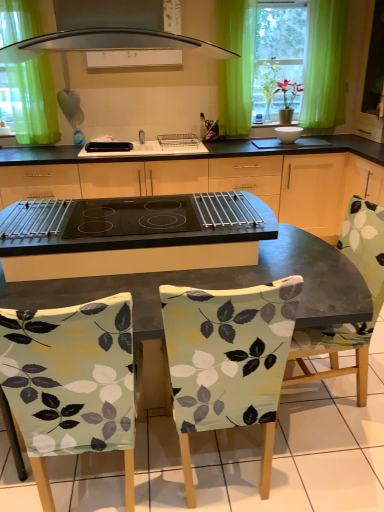
Question: Can you confirm if green fabric curtain at upper left, the 2th curtain in the right-to-left sequence, is thinner than black glass cooktop at center?

Choices:
 (A) yes
 (B) no

Answer: (A)

Question: From the image's perspective, is green fabric curtain at upper left, which is counted as the 1th curtain, starting from the left, above black glass cooktop at center?

Choices:
 (A) yes
 (B) no

Answer: (A)

Question: From a real-world perspective, does green fabric curtain at upper left, which is counted as the 1th curtain, starting from the left, sit lower than black glass cooktop at center?

Choices:
 (A) yes
 (B) no

Answer: (B)

Question: Could you tell me if green fabric curtain at upper left, the 2th curtain in the right-to-left sequence, is facing black glass cooktop at center?

Choices:
 (A) no
 (B) yes

Answer: (A)

Question: From the image's perspective, is green fabric curtain at upper left, which is counted as the 1th curtain, starting from the left, beneath black glass cooktop at center?

Choices:
 (A) yes
 (B) no

Answer: (B)

Question: From a real-world perspective, is printed fabric chair at center, the 1th chair viewed from the right, above or below light green fabric chair at lower left, which is the 1th chair in left-to-right order?

Choices:
 (A) below
 (B) above

Answer: (A)

Question: From the image's perspective, relative to light green fabric chair at lower left, which is the 1th chair in left-to-right order, is printed fabric chair at center, which is the 3th chair in left-to-right order, above or below?

Choices:
 (A) below
 (B) above

Answer: (B)

Question: Considering the positions of printed fabric chair at center, which is the 3th chair in left-to-right order, and light green fabric chair at lower left, marked as the third chair in a right-to-left arrangement, in the image, is printed fabric chair at center, which is the 3th chair in left-to-right order, bigger or smaller than light green fabric chair at lower left, marked as the third chair in a right-to-left arrangement,?

Choices:
 (A) big
 (B) small

Answer: (A)

Question: From their relative heights in the image, would you say printed fabric chair at center, the 1th chair viewed from the right, is taller or shorter than light green fabric chair at lower left, which is the 1th chair in left-to-right order?

Choices:
 (A) tall
 (B) short

Answer: (B)

Question: From their relative heights in the image, would you say green fabric curtain at upper left, which is counted as the 1th curtain, starting from the left, is taller or shorter than white glossy bowl at center, which is the 1th appliance from right to left?

Choices:
 (A) tall
 (B) short

Answer: (A)

Question: In terms of width, does green fabric curtain at upper left, which is counted as the 1th curtain, starting from the left, look wider or thinner when compared to white glossy bowl at center, which is the 1th appliance from right to left?

Choices:
 (A) wide
 (B) thin

Answer: (B)

Question: From the image's perspective, is green fabric curtain at upper left, which is counted as the 1th curtain, starting from the left, positioned above or below white glossy bowl at center, positioned as the 2th appliance in left-to-right order?

Choices:
 (A) below
 (B) above

Answer: (B)

Question: Would you say green fabric curtain at upper left, which is counted as the 1th curtain, starting from the left, is inside or outside white glossy bowl at center, which is the 1th appliance from right to left?

Choices:
 (A) outside
 (B) inside

Answer: (A)

Question: From the image's perspective, relative to green sheer curtain at upper center, which ranks as the 2th curtain in left-to-right order, is light green fabric chair at lower left, which is the 1th chair in left-to-right order, above or below?

Choices:
 (A) above
 (B) below

Answer: (B)

Question: Based on their positions, is light green fabric chair at lower left, which is the 1th chair in left-to-right order, located to the left or right of green sheer curtain at upper center, which ranks as the 2th curtain in left-to-right order?

Choices:
 (A) left
 (B) right

Answer: (A)